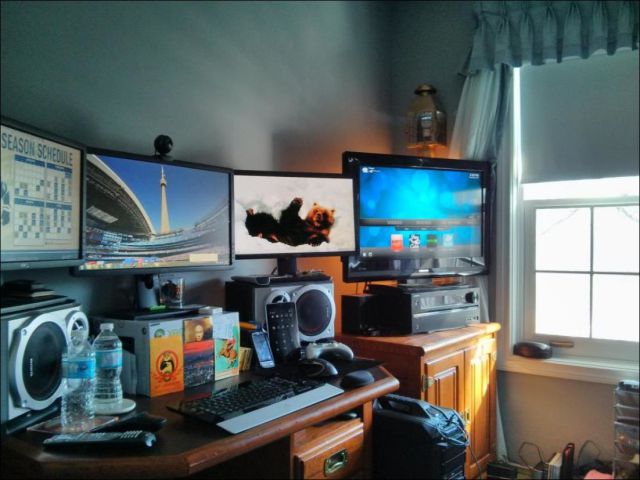
Locate an element on the screen. mouse is located at coordinates (324, 369).